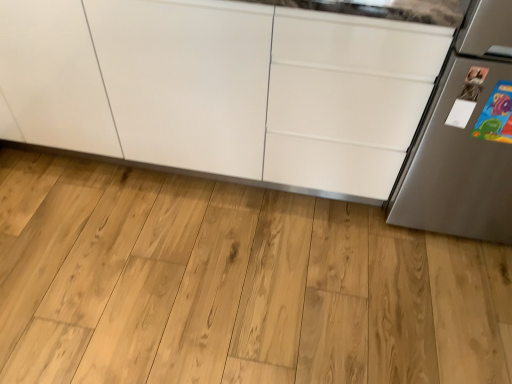
Where is `empty space that is ontop of natural wood flooring at center (from a real-world perspective)`? This screenshot has height=384, width=512. empty space that is ontop of natural wood flooring at center (from a real-world perspective) is located at coordinates (221, 267).